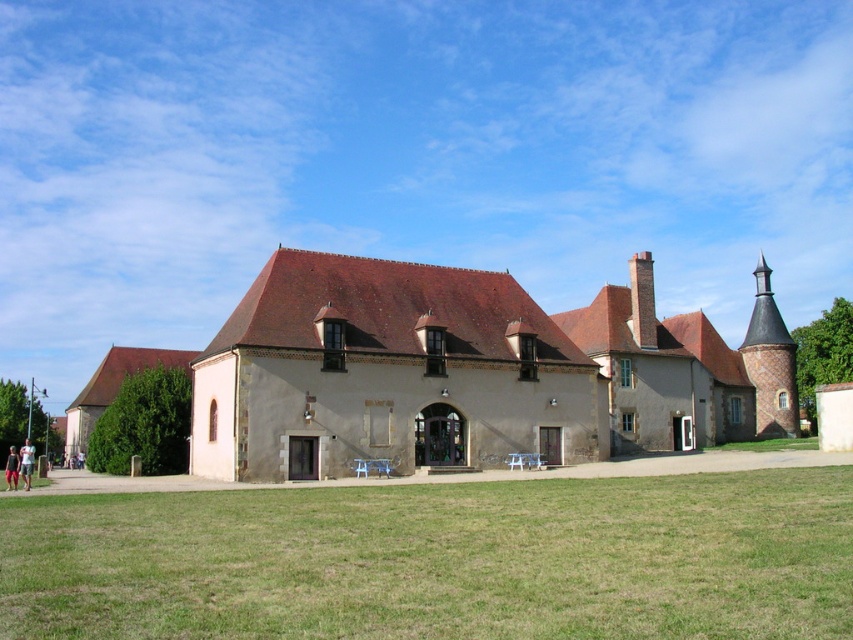
Question: Which of the following is the farthest from the observer?

Choices:
 (A) (45, 572)
 (B) (650, 272)

Answer: (B)

Question: Is green grass at lower center to the left of brown brick chimney at upper right from the viewer's perspective?

Choices:
 (A) no
 (B) yes

Answer: (B)

Question: Can you confirm if green grass at lower center is positioned below brown brick chimney at upper right?

Choices:
 (A) no
 (B) yes

Answer: (B)

Question: Among these points, which one is nearest to the camera?

Choices:
 (A) (759, 358)
 (B) (338, 625)

Answer: (B)

Question: Based on their relative distances, which object is nearer to the green grass at lower center?

Choices:
 (A) brick chimney at center
 (B) brown brick chimney at upper right

Answer: (A)

Question: Does green grass at lower center have a lesser width compared to brown brick chimney at upper right?

Choices:
 (A) yes
 (B) no

Answer: (A)